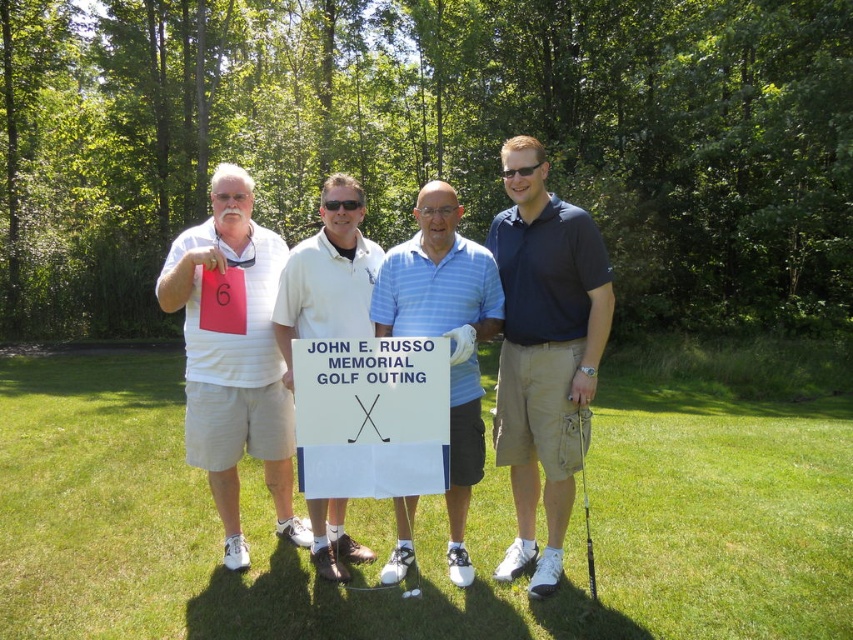
Question: Is dark blue polo shirt at center to the left of white cotton polo shirt at center from the viewer's perspective?

Choices:
 (A) no
 (B) yes

Answer: (A)

Question: Among these points, which one is farthest from the camera?

Choices:
 (A) (753, 445)
 (B) (305, 529)

Answer: (A)

Question: Which point is closer to the camera taking this photo?

Choices:
 (A) (669, 428)
 (B) (426, 278)

Answer: (B)

Question: Which object appears farthest from the camera in this image?

Choices:
 (A) green grass at center
 (B) white matte shorts at left
 (C) white cotton polo shirt at center
 (D) metallic silver golf club at lower center

Answer: (B)

Question: Is white cotton polo shirt at center positioned behind metallic silver golf club at lower center?

Choices:
 (A) yes
 (B) no

Answer: (A)

Question: Can you confirm if blue striped polo shirt at center is bigger than metallic silver golf club at lower center?

Choices:
 (A) yes
 (B) no

Answer: (A)